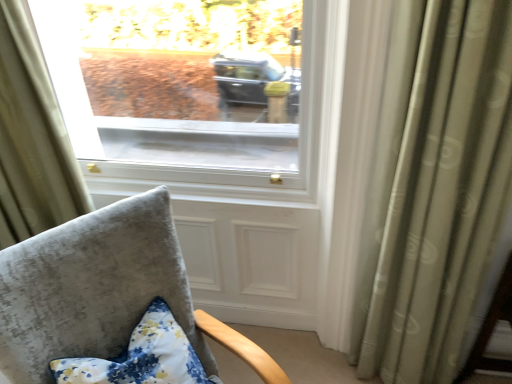
Question: Is point (65, 226) closer or farther from the camera than point (0, 49)?

Choices:
 (A) farther
 (B) closer

Answer: (B)

Question: Choose the correct answer: Is velvet gray chair at lower left inside light beige fabric curtain at upper left, which ranks as the second curtain in right-to-left order, or outside it?

Choices:
 (A) inside
 (B) outside

Answer: (B)

Question: Based on their relative distances, which object is farther from the light beige fabric curtain at upper left, the 1th curtain from the left?

Choices:
 (A) floral fabric pillow at lower left
 (B) velvet gray chair at lower left
 (C) silky green curtain at right, which is the 1th curtain from right to left

Answer: (C)

Question: Which of these objects is positioned closest to the floral fabric pillow at lower left?

Choices:
 (A) silky green curtain at right, which is the 2th curtain from left to right
 (B) light beige fabric curtain at upper left, which ranks as the second curtain in right-to-left order
 (C) velvet gray chair at lower left

Answer: (C)